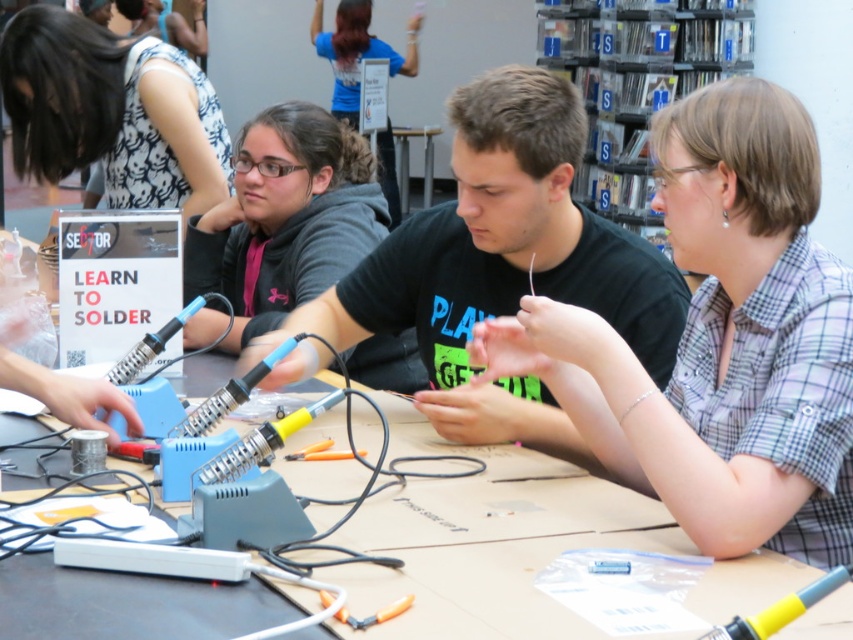
Question: Which point is farther from the camera taking this photo?

Choices:
 (A) (396, 596)
 (B) (457, 140)
 (C) (780, 298)
 (D) (166, 45)

Answer: (D)

Question: Based on their relative distances, which object is farther from the wooden table at center?

Choices:
 (A) plaid cotton shirt at center
 (B) black matte t-shirt at center
 (C) white printed dress at upper left

Answer: (C)

Question: Observing the image, what is the correct spatial positioning of black matte t-shirt at center in reference to wooden table at center?

Choices:
 (A) below
 (B) above

Answer: (B)

Question: Is plaid cotton shirt at center smaller than white printed dress at upper left?

Choices:
 (A) yes
 (B) no

Answer: (A)

Question: Among these points, which one is nearest to the camera?

Choices:
 (A) (405, 296)
 (B) (108, 32)

Answer: (A)

Question: Does plaid cotton shirt at center appear over white printed dress at upper left?

Choices:
 (A) yes
 (B) no

Answer: (B)